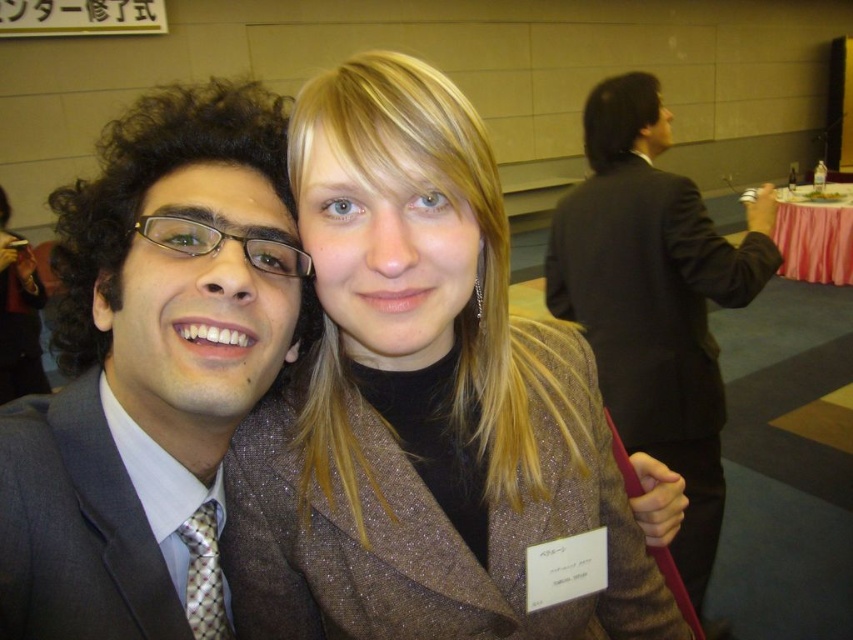
You are a photographer standing 6 feet away from the black suit at upper right and dark gray textured suit at left. Can you capture both suits in a single frame without moving the camera? Explain your reasoning based on the distance between them.

The distance between the black suit at upper right and dark gray textured suit at left is 4.92 feet. Since you are 6 feet away from both suits, the total distance between them is less than the distance from the photographer, so they can both fit in the frame without moving the camera.

You are standing in the room and want to take a photo of the matte gray suit at left. Where should you position yourself to capture it in the frame?

The matte gray suit at left is located at point (149, 358), so you should position yourself at that coordinate to capture it in the frame.